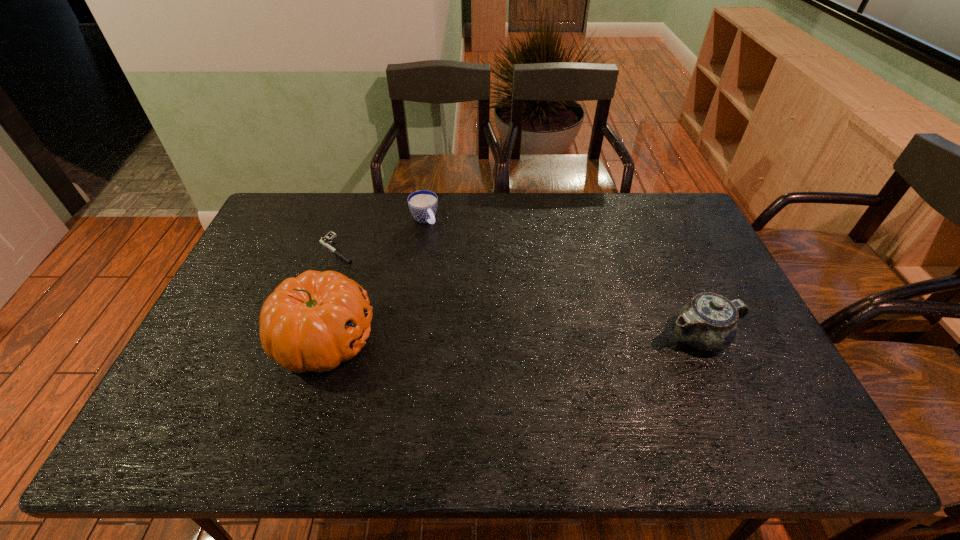
Identify the location of pumpkin. The width and height of the screenshot is (960, 540). (313, 322).

Where is `the rightmost object`? The height and width of the screenshot is (540, 960). the rightmost object is located at coordinates (708, 322).

You are a GUI agent. You are given a task and a screenshot of the screen. Output one action in this format:
    pyautogui.click(x=<x>, y=<y>)
    Task: Click on the chinaware
    The width and height of the screenshot is (960, 540).
    Given the screenshot: What is the action you would take?
    pyautogui.click(x=708, y=322)

Find the location of a particular element. This screenshot has height=540, width=960. the second shortest object is located at coordinates (423, 204).

This screenshot has width=960, height=540. I want to click on cup, so click(423, 204).

At what (x,y) coordinates should I click in order to perform the action: click on the shortest object. Please return your answer as a coordinate pair (x, y). Image resolution: width=960 pixels, height=540 pixels. Looking at the image, I should click on (327, 241).

Where is `pistol`? This screenshot has width=960, height=540. pistol is located at coordinates (327, 241).

The image size is (960, 540). In order to click on vacant area situated on the carved face of the tallest object in this screenshot , I will do `click(415, 339)`.

Where is `vacant space situated on the side of the second shortest object with the handle`? vacant space situated on the side of the second shortest object with the handle is located at coordinates (467, 273).

Where is `vacant area situated on the side of the second shortest object with the handle`? vacant area situated on the side of the second shortest object with the handle is located at coordinates (469, 277).